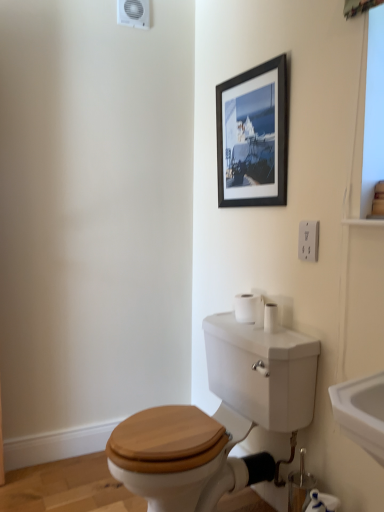
Where is `wooden toilet seat at center`? The image size is (384, 512). wooden toilet seat at center is located at coordinates (260, 377).

This screenshot has width=384, height=512. Find the location of `white glossy sink at lower right`. white glossy sink at lower right is located at coordinates (361, 412).

The height and width of the screenshot is (512, 384). What are the coordinates of `white matte toilet paper at right, acting as the 1th toilet paper starting from the top` in the screenshot? It's located at (271, 318).

In the image, is white matte toilet paper at right, the second toilet paper when ordered from right to left, positioned in front of or behind white matte toilet paper at lower right, the 1th toilet paper in the front-to-back sequence?

white matte toilet paper at right, the second toilet paper when ordered from right to left, is behind white matte toilet paper at lower right, the 1th toilet paper in the front-to-back sequence.

Which is more to the left, white matte toilet paper at right, acting as the 1th toilet paper starting from the top, or white matte toilet paper at lower right, the 1th toilet paper in the front-to-back sequence?

Positioned to the left is white matte toilet paper at right, acting as the 1th toilet paper starting from the top.

From a real-world perspective, is white matte toilet paper at right, the second toilet paper when ordered from right to left, located beneath white matte toilet paper at lower right, the 1th toilet paper in the front-to-back sequence?

No.

From their relative heights in the image, would you say white matte toilet paper at right, the second toilet paper when ordered from right to left, is taller or shorter than white matte toilet paper at lower right, the 1th toilet paper in the front-to-back sequence?

white matte toilet paper at right, the second toilet paper when ordered from right to left, is shorter than white matte toilet paper at lower right, the 1th toilet paper in the front-to-back sequence.

Which of these two, white plastic electrical outlet at upper right or black matte picture frame at upper center, stands taller?

black matte picture frame at upper center.

What's the angular difference between white plastic electrical outlet at upper right and black matte picture frame at upper center's facing directions?

The angular difference between white plastic electrical outlet at upper right and black matte picture frame at upper center is 1.48 degrees.

From a real-world perspective, who is located lower, white plastic electrical outlet at upper right or black matte picture frame at upper center?

In real-world perspective, white plastic electrical outlet at upper right is lower.

Does white matte toilet paper at lower right, which ranks as the 1th toilet paper in bottom-to-top order, have a larger size compared to wooden toilet seat at center?

Incorrect, white matte toilet paper at lower right, which ranks as the 1th toilet paper in bottom-to-top order, is not larger than wooden toilet seat at center.

This screenshot has width=384, height=512. In order to click on toilet above the white matte toilet paper at lower right, arranged as the 1th toilet paper when viewed from the right (from a real-world perspective) in this screenshot , I will do `click(260, 377)`.

Considering the relative positions of white matte toilet paper at lower right, arranged as the 1th toilet paper when viewed from the right, and wooden toilet seat at center in the image provided, is white matte toilet paper at lower right, arranged as the 1th toilet paper when viewed from the right, to the left of wooden toilet seat at center from the viewer's perspective?

In fact, white matte toilet paper at lower right, arranged as the 1th toilet paper when viewed from the right, is to the right of wooden toilet seat at center.

The width and height of the screenshot is (384, 512). I want to click on electric outlet located above the white matte toilet paper at right, acting as the 1th toilet paper starting from the top (from a real-world perspective), so click(x=308, y=241).

Looking at this image, could you tell me if white plastic electrical outlet at upper right is turned towards white matte toilet paper at right, which is the first toilet paper in back-to-front order?

No, white plastic electrical outlet at upper right is not facing towards white matte toilet paper at right, which is the first toilet paper in back-to-front order.

Which of these two, white plastic electrical outlet at upper right or white matte toilet paper at right, which is the first toilet paper in back-to-front order, is bigger?

white matte toilet paper at right, which is the first toilet paper in back-to-front order.

Is wooden toilet seat at center facing towards white plastic electrical outlet at upper right?

No, wooden toilet seat at center is not turned towards white plastic electrical outlet at upper right.

From the image's perspective, who appears lower, wooden toilet seat at center or white plastic electrical outlet at upper right?

wooden toilet seat at center appears lower in the image.

Consider the image. Is wooden toilet seat at center far from white plastic electrical outlet at upper right?

That's not correct — wooden toilet seat at center is a little close to white plastic electrical outlet at upper right.

In the image, is white plastic electrical outlet at upper right on the left side or the right side of white matte toilet paper at lower right, the 1th toilet paper in the front-to-back sequence?

Based on their positions, white plastic electrical outlet at upper right is located to the left of white matte toilet paper at lower right, the 1th toilet paper in the front-to-back sequence.

Is white plastic electrical outlet at upper right oriented towards white matte toilet paper at lower right, the 2th toilet paper viewed from the left?

No, white plastic electrical outlet at upper right is not oriented towards white matte toilet paper at lower right, the 2th toilet paper viewed from the left.

From the image's perspective, is white plastic electrical outlet at upper right below white matte toilet paper at lower right, which ranks as the 1th toilet paper in bottom-to-top order?

Actually, white plastic electrical outlet at upper right appears above white matte toilet paper at lower right, which ranks as the 1th toilet paper in bottom-to-top order, in the image.

Would you say white plastic electrical outlet at upper right is inside or outside white matte toilet paper at lower right, the second toilet paper positioned from the top?

white plastic electrical outlet at upper right is not enclosed by white matte toilet paper at lower right, the second toilet paper positioned from the top.

Looking at this image, considering the sizes of black matte picture frame at upper center and white matte toilet paper at lower right, the 2th toilet paper viewed from the left, in the image, is black matte picture frame at upper center wider or thinner than white matte toilet paper at lower right, the 2th toilet paper viewed from the left,?

black matte picture frame at upper center is thinner than white matte toilet paper at lower right, the 2th toilet paper viewed from the left.

Based on the photo, is the position of black matte picture frame at upper center more distant than that of white matte toilet paper at lower right, the 1th toilet paper in the front-to-back sequence?

That is True.

Is black matte picture frame at upper center positioned far away from white matte toilet paper at lower right, the 1th toilet paper in the front-to-back sequence?

Yes, black matte picture frame at upper center is far from white matte toilet paper at lower right, the 1th toilet paper in the front-to-back sequence.

Is black matte picture frame at upper center smaller than white matte toilet paper at lower right, which ranks as the 1th toilet paper in bottom-to-top order?

No.

The image size is (384, 512). In order to click on toilet paper that appears above the white matte toilet paper at lower right, the 2th toilet paper viewed from the left (from a real-world perspective) in this screenshot , I will do `click(271, 318)`.

Find the location of a particular element. electric outlet in front of the black matte picture frame at upper center is located at coordinates (308, 241).

Looking at the image, which one is located closer to white matte toilet paper at right, which is the first toilet paper in back-to-front order, black matte picture frame at upper center or white matte toilet paper at lower right, the second toilet paper positioned from the top?

Based on the image, white matte toilet paper at lower right, the second toilet paper positioned from the top, appears to be nearer to white matte toilet paper at right, which is the first toilet paper in back-to-front order.

Based on their spatial positions, is white glossy sink at lower right or black matte picture frame at upper center closer to white plastic electrical outlet at upper right?

black matte picture frame at upper center lies closer to white plastic electrical outlet at upper right than the other object.

Which object lies nearer to the anchor point wooden toilet seat at center, black matte picture frame at upper center or white matte toilet paper at right, the second toilet paper when ordered from right to left?

white matte toilet paper at right, the second toilet paper when ordered from right to left.

In the scene shown: When comparing their distances from white glossy sink at lower right, does white matte toilet paper at right, the second toilet paper when ordered from right to left, or white plastic electrical outlet at upper right seem further?

Based on the image, white matte toilet paper at right, the second toilet paper when ordered from right to left, appears to be further to white glossy sink at lower right.

Based on their spatial positions, is white matte toilet paper at lower right, the 2th toilet paper when ordered from back to front, or black matte picture frame at upper center closer to white glossy sink at lower right?

white matte toilet paper at lower right, the 2th toilet paper when ordered from back to front, is closer to white glossy sink at lower right.

From the image, which object appears to be farther from white matte toilet paper at lower right, the 2th toilet paper when ordered from back to front, black matte picture frame at upper center or wooden toilet seat at center?

Based on the image, black matte picture frame at upper center appears to be further to white matte toilet paper at lower right, the 2th toilet paper when ordered from back to front.

Based on their spatial positions, is black matte picture frame at upper center or white glossy sink at lower right further from wooden toilet seat at center?

Based on the image, black matte picture frame at upper center appears to be further to wooden toilet seat at center.

From the image, which object appears to be nearer to white plastic electrical outlet at upper right, black matte picture frame at upper center or white glossy sink at lower right?

The object closer to white plastic electrical outlet at upper right is black matte picture frame at upper center.

I want to click on toilet paper between black matte picture frame at upper center and white matte toilet paper at lower right, the 1th toilet paper in the front-to-back sequence, in the up-down direction, so click(x=271, y=318).

The image size is (384, 512). Identify the location of sink between white plastic electrical outlet at upper right and wooden toilet seat at center in the vertical direction. (361, 412).

This screenshot has height=512, width=384. I want to click on toilet paper between white plastic electrical outlet at upper right and white matte toilet paper at lower right, the 2th toilet paper when ordered from back to front, in the vertical direction, so tap(271, 318).

The height and width of the screenshot is (512, 384). I want to click on toilet that lies between white plastic electrical outlet at upper right and white matte toilet paper at lower right, the 2th toilet paper when ordered from back to front, from top to bottom, so click(260, 377).